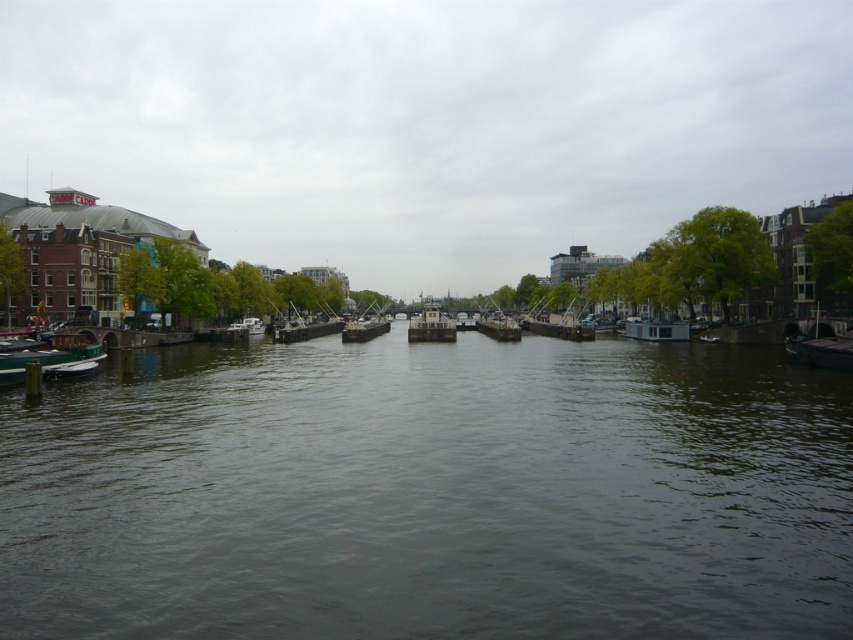
Question: Which object appears farthest from the camera in this image?

Choices:
 (A) wooden sailboat at center
 (B) cloudy sky at center
 (C) wooden boat at center
 (D) green matte boat at lower left

Answer: (B)

Question: Can you confirm if green matte boat at lower left is smaller than white matte houseboat at right?

Choices:
 (A) yes
 (B) no

Answer: (A)

Question: Can you confirm if dark water at center is positioned below wooden boat at center?

Choices:
 (A) yes
 (B) no

Answer: (A)

Question: Does cloudy sky at center have a lesser width compared to white glossy boat at left?

Choices:
 (A) yes
 (B) no

Answer: (B)

Question: Which point is closer to the camera?

Choices:
 (A) green matte boat at lower left
 (B) metallic gray boat at center
 (C) dark gray metallic boat at right
 (D) dark water at center

Answer: (D)

Question: Which object is closer to the camera taking this photo?

Choices:
 (A) metallic gray boat at center
 (B) dark gray metallic boat at right

Answer: (B)